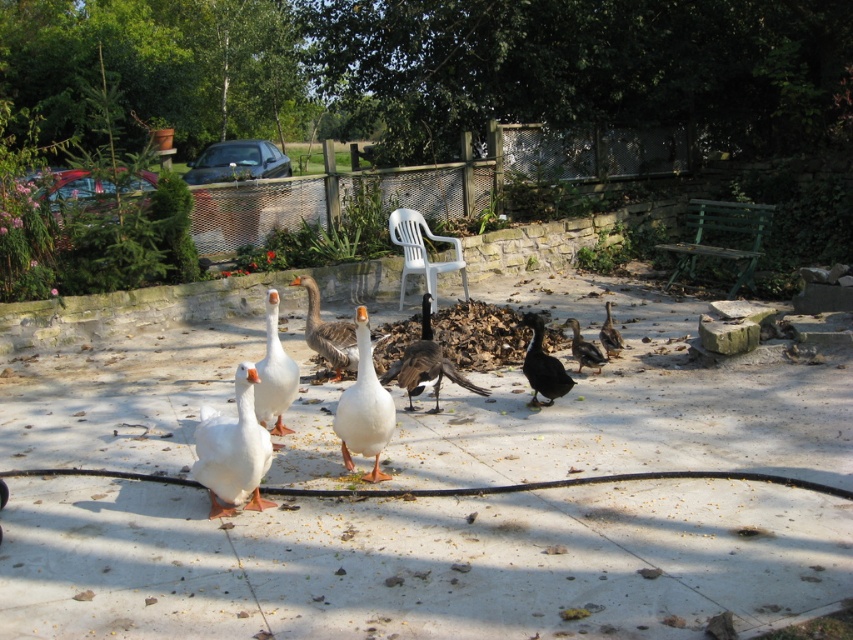
Looking at this image, you are a small robot with a 2 meter arm reach. You want to pick up both the gray matte goose at center and the brown matte duck at center. Can your arm reach both from your current position?

The distance between the gray matte goose at center and the brown matte duck at center is 2.23 meters. Since your arm can only reach 2 meters, you cannot reach both from your current position.

You are a photographer trying to capture a closeup of the white glossy goose at center and the dark brown feathers at center. Since you want both subjects in focus, you need to know which one is closer to you. Can you determine which is nearer?

The white glossy goose at center is bigger than dark brown feathers at center, so the goose is closer to you.